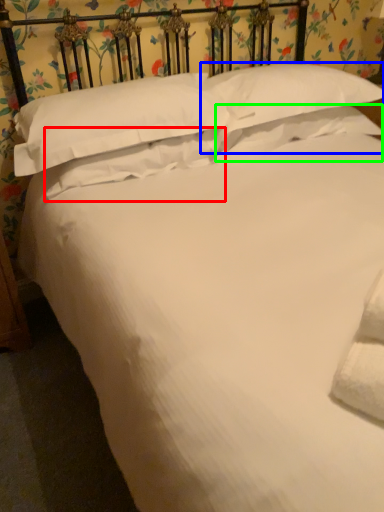
Question: Based on their relative distances, which object is nearer to pillow (highlighted by a red box)? Choose from pillow (highlighted by a blue box) and pillow (highlighted by a green box).

Choices:
 (A) pillow
 (B) pillow

Answer: (B)